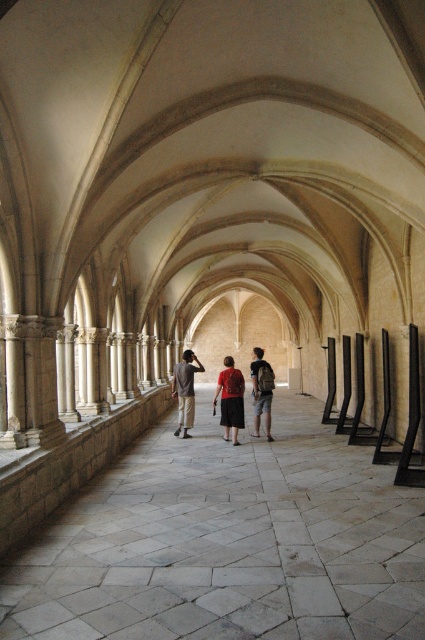
Between point (314, 436) and point (234, 412), which one is positioned behind?

The point (314, 436) is behind.

How far apart are gray stone walkway at center and matte red blouse at center?

gray stone walkway at center and matte red blouse at center are 5.19 meters apart.

The image size is (425, 640). Find the location of `gray stone walkway at center`. gray stone walkway at center is located at coordinates (227, 541).

The width and height of the screenshot is (425, 640). I want to click on gray stone walkway at center, so click(x=227, y=541).

Does point (214, 595) lie behind point (175, 374)?

No, it is not.

Can you confirm if gray stone walkway at center is taller than khaki cotton pants at center?

Incorrect, gray stone walkway at center's height is not larger of khaki cotton pants at center's.

Describe the element at coordinates (227, 541) in the screenshot. The image size is (425, 640). I see `gray stone walkway at center` at that location.

This screenshot has width=425, height=640. I want to click on gray stone walkway at center, so click(x=227, y=541).

Does matte red blouse at center appear under khaki cotton pants at center?

Actually, matte red blouse at center is above khaki cotton pants at center.

Consider the image. Is matte red blouse at center above khaki cotton pants at center?

Indeed, matte red blouse at center is positioned over khaki cotton pants at center.

Measure the distance between point (229,356) and camera.

40.96 meters

Identify the location of matte red blouse at center. The width and height of the screenshot is (425, 640). (231, 400).